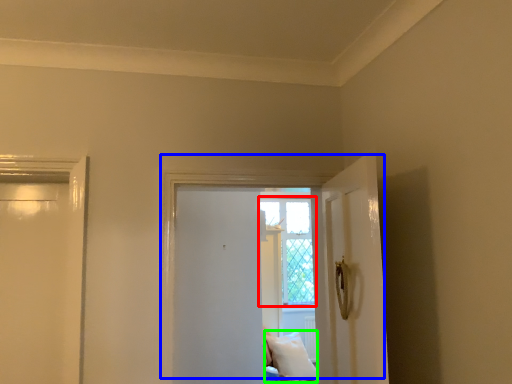
Question: Which object is positioned closest to window (highlighted by a red box)? Select from door (highlighted by a blue box) and pillow (highlighted by a green box).

Choices:
 (A) door
 (B) pillow

Answer: (B)